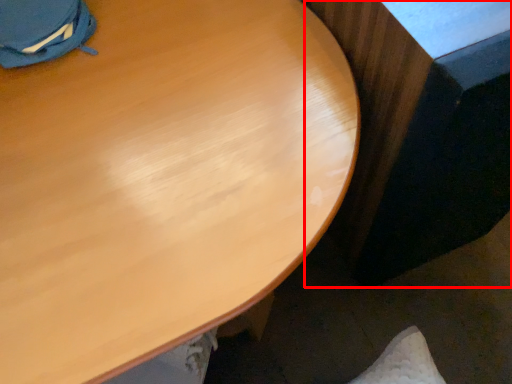
Question: From the image's perspective, where is table (annotated by the red box) located in relation to desk in the image?

Choices:
 (A) below
 (B) above

Answer: (B)